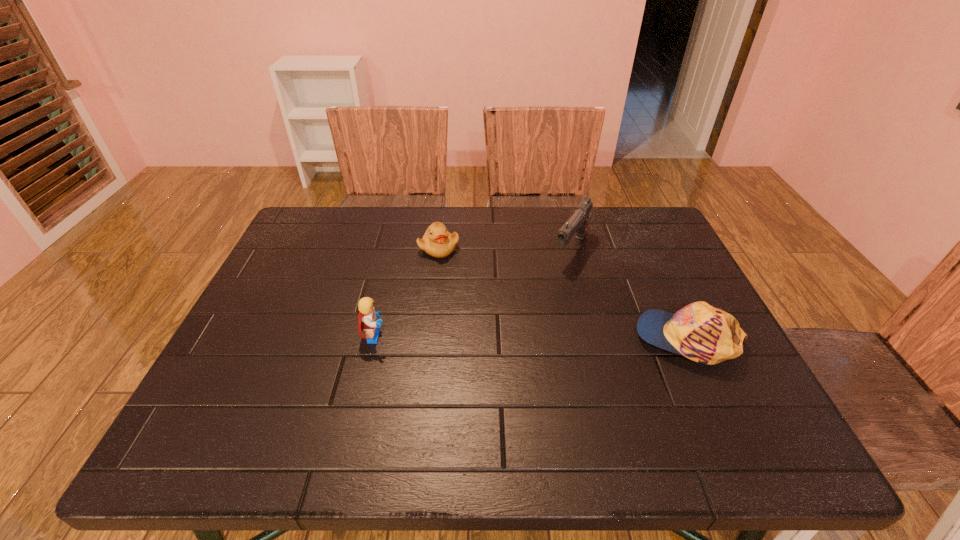
The height and width of the screenshot is (540, 960). I want to click on free spot on the desktop that is between the Lego and the cap and is positioned in the direction the gun is aimed, so click(x=508, y=338).

At what (x,y) coordinates should I click in order to perform the action: click on free space on the desktop that is between the Lego and the rightmost object and is positioned on the front-facing side of the duckling. Please return your answer as a coordinate pair (x, y). Looking at the image, I should click on (504, 338).